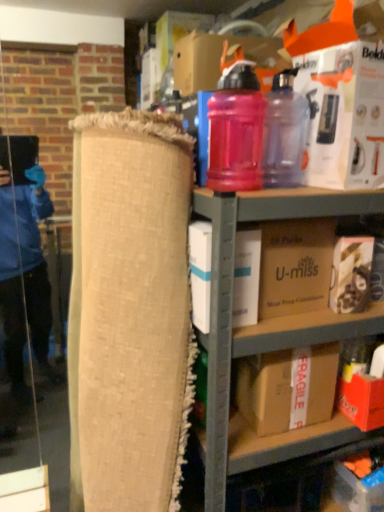
Question: Does white cardboard box at upper right, acting as the first box starting from the top, appear on the left side of matte plastic shelf at upper center?

Choices:
 (A) no
 (B) yes

Answer: (B)

Question: Is the depth of white cardboard box at upper right, acting as the first box starting from the top, greater than that of matte plastic shelf at upper center?

Choices:
 (A) yes
 (B) no

Answer: (A)

Question: Does white cardboard box at upper right, the 5th box from the bottom, have a smaller size compared to matte plastic shelf at upper center?

Choices:
 (A) yes
 (B) no

Answer: (A)

Question: Is white cardboard box at upper right, acting as the first box starting from the top, outside of matte plastic shelf at upper center?

Choices:
 (A) no
 (B) yes

Answer: (B)

Question: From a real-world perspective, is white cardboard box at upper right, acting as the first box starting from the top, on matte plastic shelf at upper center?

Choices:
 (A) no
 (B) yes

Answer: (B)

Question: Considering the relative sizes of white cardboard box at upper right, acting as the first box starting from the top, and matte plastic shelf at upper center in the image provided, is white cardboard box at upper right, acting as the first box starting from the top, taller than matte plastic shelf at upper center?

Choices:
 (A) yes
 (B) no

Answer: (B)

Question: Can you confirm if pink translucent water bottle at upper right, which is the first bottle in right-to-left order, is positioned to the right of fragile cardboard box at center, the fifth box in the top-to-bottom sequence?

Choices:
 (A) yes
 (B) no

Answer: (B)

Question: Is pink translucent water bottle at upper right, which is the first bottle in right-to-left order, to the left of fragile cardboard box at center, the fifth box in the top-to-bottom sequence, from the viewer's perspective?

Choices:
 (A) yes
 (B) no

Answer: (A)

Question: Is fragile cardboard box at center, which ranks as the first box in bottom-to-top order, completely or partially inside pink translucent water bottle at upper right, which ranks as the second bottle in left-to-right order?

Choices:
 (A) no
 (B) yes

Answer: (A)

Question: Does pink translucent water bottle at upper right, which ranks as the second bottle in left-to-right order, turn towards fragile cardboard box at center, the fifth box in the top-to-bottom sequence?

Choices:
 (A) no
 (B) yes

Answer: (A)

Question: Is pink translucent water bottle at upper right, which is the first bottle in right-to-left order, smaller than fragile cardboard box at center, the fifth box in the top-to-bottom sequence?

Choices:
 (A) yes
 (B) no

Answer: (A)

Question: Is pink translucent water bottle at upper right, which ranks as the second bottle in left-to-right order, closer to the viewer compared to fragile cardboard box at center, the fifth box in the top-to-bottom sequence?

Choices:
 (A) no
 (B) yes

Answer: (B)

Question: Considering the relative sizes of pink translucent bottle at upper center, placed as the second bottle when sorted from right to left, and brown cardboard box at center, which ranks as the 4th box in bottom-to-top order, in the image provided, is pink translucent bottle at upper center, placed as the second bottle when sorted from right to left, thinner than brown cardboard box at center, which ranks as the 4th box in bottom-to-top order,?

Choices:
 (A) yes
 (B) no

Answer: (A)